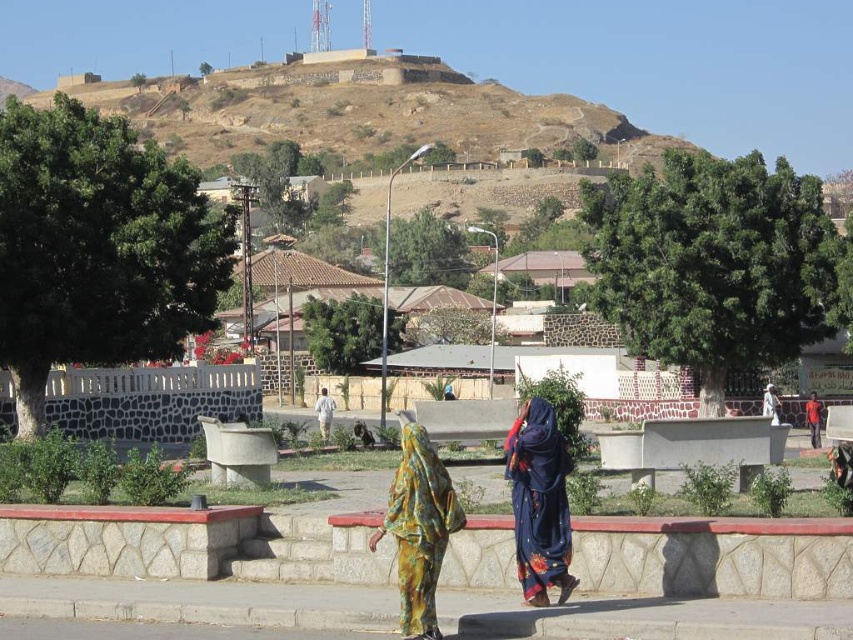
Does blue floral fabric at center come in front of white fabric headscarf at center?

Yes.

Who is shorter, blue floral fabric at center or white fabric headscarf at center?

blue floral fabric at center

Is point (556, 428) closer to camera compared to point (775, 412)?

That is True.

Locate an element on the screen. blue floral fabric at center is located at coordinates (538, 502).

Does floral fabric dress at center have a lesser width compared to red cotton shirt at center?

Indeed, floral fabric dress at center has a lesser width compared to red cotton shirt at center.

Measure the distance between floral fabric dress at center and camera.

They are 27.00 meters apart.

The height and width of the screenshot is (640, 853). Describe the element at coordinates (419, 529) in the screenshot. I see `floral fabric dress at center` at that location.

Where is `floral fabric dress at center`? The image size is (853, 640). floral fabric dress at center is located at coordinates (419, 529).

Which of these two, floral fabric dress at center or white fabric headscarf at center, stands taller?

floral fabric dress at center

Does floral fabric dress at center appear on the left side of white fabric headscarf at center?

Indeed, floral fabric dress at center is positioned on the left side of white fabric headscarf at center.

Describe the element at coordinates (419, 529) in the screenshot. I see `floral fabric dress at center` at that location.

Identify the location of floral fabric dress at center. (419, 529).